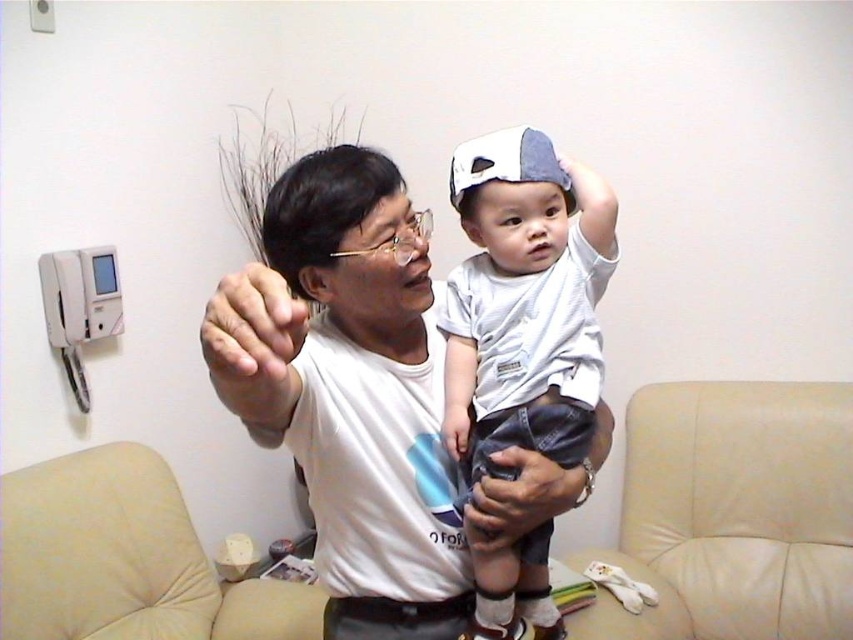
Question: From the image, what is the correct spatial relationship of matte gray hand at center in relation to white fabric baseball hat at upper center?

Choices:
 (A) right
 (B) left

Answer: (A)

Question: Which object is the farthest from the white fabric baseball hat at upper center?

Choices:
 (A) beige leather couch at lower center
 (B) matte gray hand at center

Answer: (A)

Question: Which point is farther to the camera?

Choices:
 (A) (535, 285)
 (B) (583, 488)
 (C) (289, 364)

Answer: (B)

Question: Which of the following is the closest to the observer?

Choices:
 (A) click(592, 609)
 (B) click(219, 308)

Answer: (B)

Question: Is beige leather couch at lower center wider than black leather pants at lower center?

Choices:
 (A) no
 (B) yes

Answer: (B)

Question: Can you confirm if matte gray hand at center is wider than black leather pants at lower center?

Choices:
 (A) yes
 (B) no

Answer: (B)